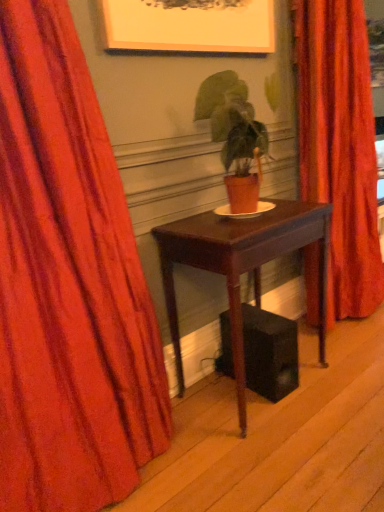
What are the coordinates of `free space in front of matte orange pot at center` in the screenshot? It's located at (238, 228).